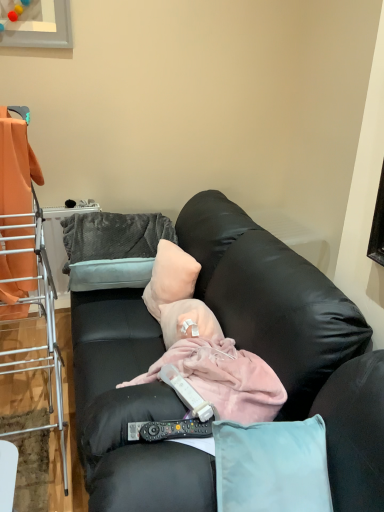
Question: Is gray plush pillow at upper left, which ranks as the 1th pillow in left-to-right order, inside orange fabric at left?

Choices:
 (A) yes
 (B) no

Answer: (B)

Question: Is orange fabric at left thinner than gray plush pillow at upper left, placed as the 2th pillow when sorted from right to left?

Choices:
 (A) no
 (B) yes

Answer: (B)

Question: Does orange fabric at left turn towards gray plush pillow at upper left, placed as the 2th pillow when sorted from right to left?

Choices:
 (A) no
 (B) yes

Answer: (A)

Question: From a real-world perspective, is orange fabric at left physically above gray plush pillow at upper left, which ranks as the 1th pillow in left-to-right order?

Choices:
 (A) no
 (B) yes

Answer: (B)

Question: Does orange fabric at left come in front of gray plush pillow at upper left, which ranks as the 1th pillow in left-to-right order?

Choices:
 (A) yes
 (B) no

Answer: (A)

Question: In the image, is gray plush pillow at upper left, which ranks as the 1th pillow in left-to-right order, on the left side or the right side of black plastic remote control at center, marked as the second remote control in a bottom-to-top arrangement?

Choices:
 (A) left
 (B) right

Answer: (A)

Question: Looking at their shapes, would you say gray plush pillow at upper left, which ranks as the 1th pillow in left-to-right order, is wider or thinner than black plastic remote control at center, the 1th remote control from the top?

Choices:
 (A) wide
 (B) thin

Answer: (A)

Question: Considering the positions of point (130, 284) and point (192, 403), is point (130, 284) closer or farther from the camera than point (192, 403)?

Choices:
 (A) farther
 (B) closer

Answer: (A)

Question: Relative to black plastic remote control at center, the 1th remote control from the top, is gray plush pillow at upper left, placed as the 2th pillow when sorted from right to left, in front or behind?

Choices:
 (A) behind
 (B) front

Answer: (A)

Question: Visually, is black leather couch at center positioned to the left or to the right of gray plush pillow at upper left, placed as the 2th pillow when sorted from right to left?

Choices:
 (A) right
 (B) left

Answer: (A)

Question: From the image's perspective, is black leather couch at center positioned above or below gray plush pillow at upper left, which ranks as the 1th pillow in left-to-right order?

Choices:
 (A) above
 (B) below

Answer: (B)

Question: Considering their positions, is black leather couch at center located in front of or behind gray plush pillow at upper left, placed as the 2th pillow when sorted from right to left?

Choices:
 (A) behind
 (B) front

Answer: (B)

Question: Considering the positions of black leather couch at center and gray plush pillow at upper left, which ranks as the 1th pillow in left-to-right order, in the image, is black leather couch at center wider or thinner than gray plush pillow at upper left, which ranks as the 1th pillow in left-to-right order,?

Choices:
 (A) wide
 (B) thin

Answer: (A)

Question: In the image, is orange fabric at left positioned in front of or behind black plastic remote control at lower center, which is the first remote control from bottom to top?

Choices:
 (A) front
 (B) behind

Answer: (A)

Question: From a real-world perspective, relative to black plastic remote control at lower center, which is the first remote control from bottom to top, is orange fabric at left vertically above or below?

Choices:
 (A) above
 (B) below

Answer: (A)